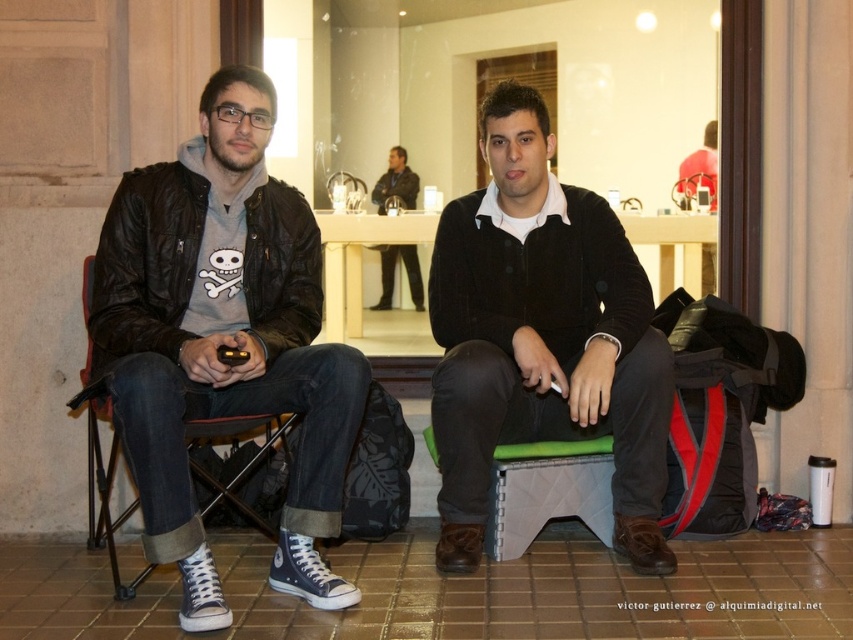
Can you confirm if dark brown sweater at center is thinner than black fabric folding chair at left?

In fact, dark brown sweater at center might be wider than black fabric folding chair at left.

Is dark brown sweater at center taller than black fabric folding chair at left?

Yes.

Between point (606, 289) and point (91, 282), which one is positioned behind?

The point (606, 289) is more distant.

Where is `dark brown sweater at center`? The image size is (853, 640). dark brown sweater at center is located at coordinates (543, 337).

Is black fabric folding chair at left shorter than green fabric stool at lower center?

No.

Consider the image. Who is shorter, black fabric folding chair at left or green fabric stool at lower center?

Standing shorter between the two is green fabric stool at lower center.

Identify the location of black fabric folding chair at left. (102, 458).

Image resolution: width=853 pixels, height=640 pixels. In order to click on black fabric folding chair at left in this screenshot , I will do `click(102, 458)`.

The width and height of the screenshot is (853, 640). What do you see at coordinates (223, 340) in the screenshot?
I see `matte black jacket at left` at bounding box center [223, 340].

Does matte black jacket at left have a lesser height compared to black fabric folding chair at left?

No, matte black jacket at left is not shorter than black fabric folding chair at left.

This screenshot has width=853, height=640. I want to click on matte black jacket at left, so click(x=223, y=340).

I want to click on matte black jacket at left, so click(223, 340).